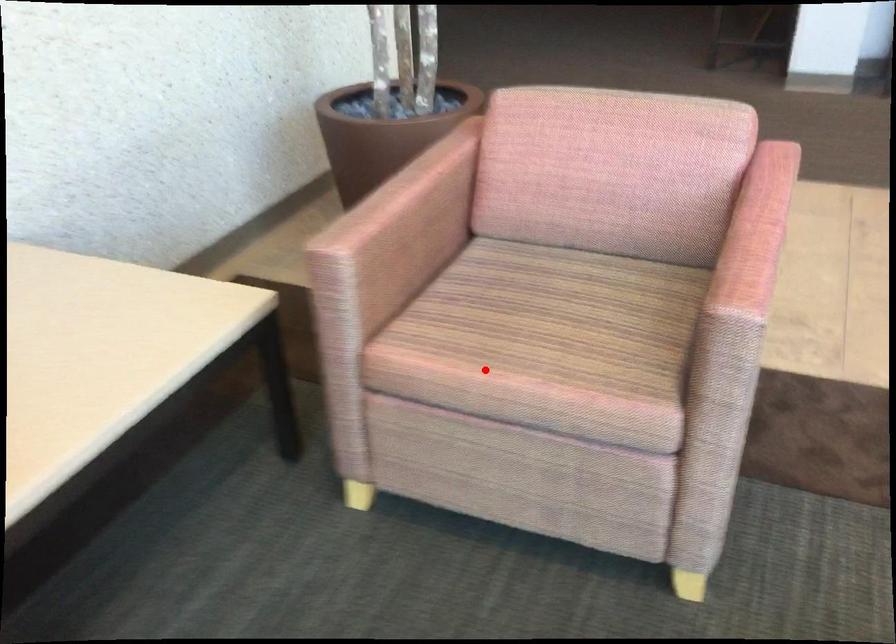
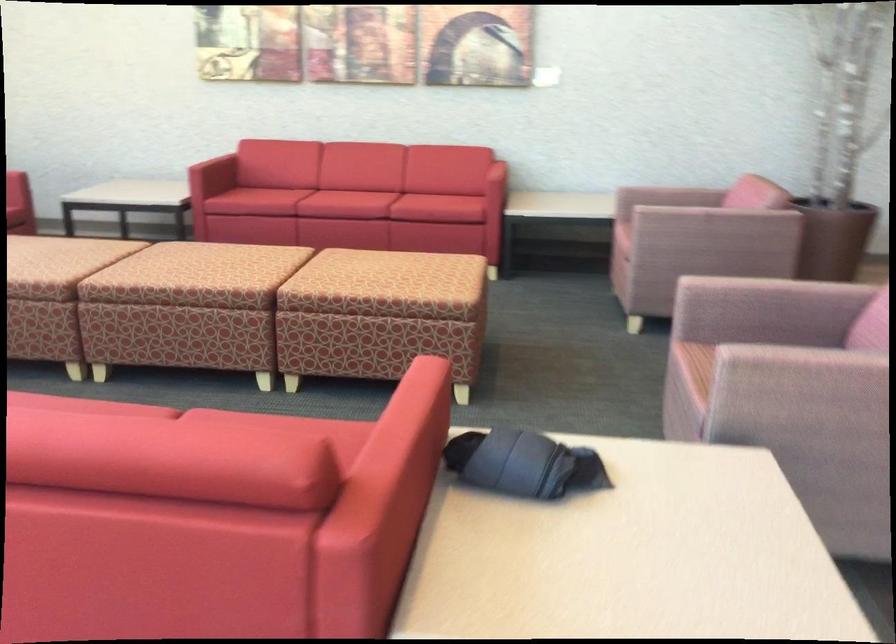
Question: I am providing you with two images of the same scene from different viewpoints. Given a red point in image1, look at the same physical point in image2. Is it:

Choices:
 (A) Closer to the viewpoint
 (B) Farther from the viewpoint

Answer: (B)